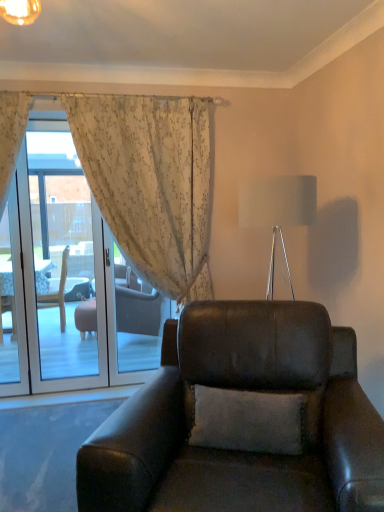
Question: Considering the relative sizes of floral sheer curtain at upper left and white fabric lampshade at upper center in the image provided, is floral sheer curtain at upper left taller than white fabric lampshade at upper center?

Choices:
 (A) yes
 (B) no

Answer: (A)

Question: Can you confirm if floral sheer curtain at upper left is wider than white fabric lampshade at upper center?

Choices:
 (A) yes
 (B) no

Answer: (B)

Question: From the image's perspective, is floral sheer curtain at upper left beneath white fabric lampshade at upper center?

Choices:
 (A) yes
 (B) no

Answer: (A)

Question: Does floral sheer curtain at upper left have a smaller size compared to white fabric lampshade at upper center?

Choices:
 (A) no
 (B) yes

Answer: (A)

Question: Is floral sheer curtain at upper left bigger than white fabric lampshade at upper center?

Choices:
 (A) yes
 (B) no

Answer: (A)

Question: Would you say floral sheer curtain at upper left is outside white fabric lampshade at upper center?

Choices:
 (A) yes
 (B) no

Answer: (A)

Question: Is transparent glass screen door at left next to floral sheer curtain at upper left and touching it?

Choices:
 (A) no
 (B) yes

Answer: (A)

Question: Is transparent glass screen door at left to the right of floral sheer curtain at upper left from the viewer's perspective?

Choices:
 (A) no
 (B) yes

Answer: (A)

Question: Does transparent glass screen door at left turn towards floral sheer curtain at upper left?

Choices:
 (A) no
 (B) yes

Answer: (A)

Question: Is transparent glass screen door at left closer to the viewer compared to floral sheer curtain at upper left?

Choices:
 (A) yes
 (B) no

Answer: (B)

Question: Is transparent glass screen door at left positioned far away from floral sheer curtain at upper left?

Choices:
 (A) yes
 (B) no

Answer: (A)

Question: Can you confirm if transparent glass screen door at left is taller than floral sheer curtain at upper left?

Choices:
 (A) yes
 (B) no

Answer: (B)

Question: Does floral sheer curtain at upper left appear on the left side of transparent glass screen door at left?

Choices:
 (A) no
 (B) yes

Answer: (A)